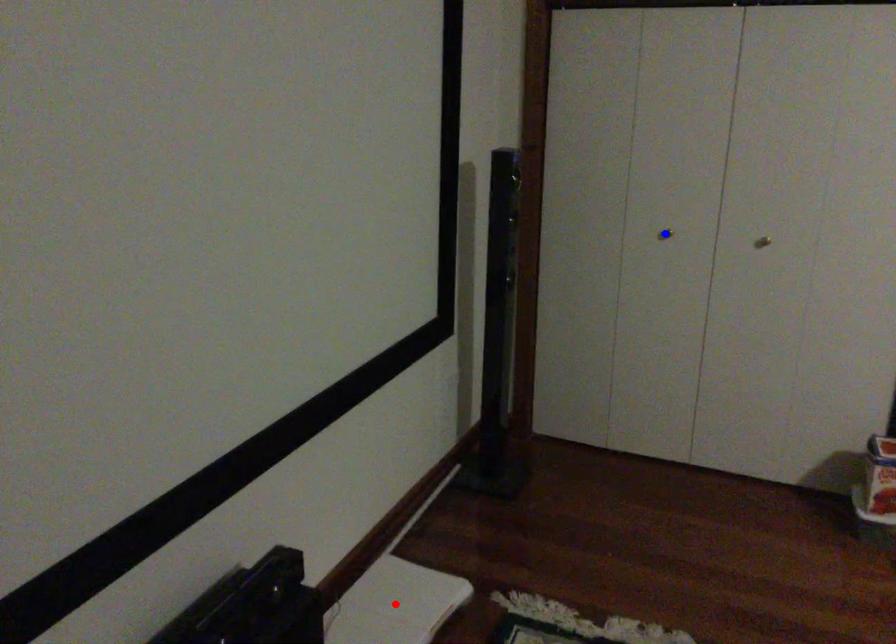
Question: Which of the two points in the image is closer to the camera?

Choices:
 (A) Blue point is closer.
 (B) Red point is closer.

Answer: (B)